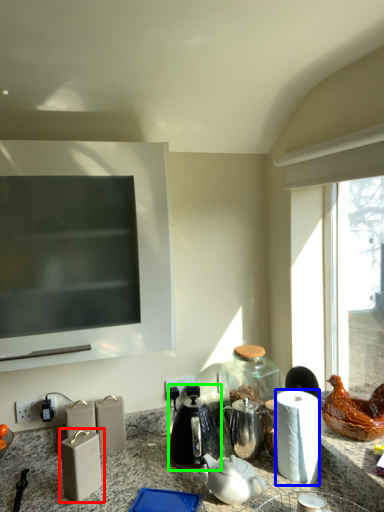
Question: Which object is the closest to the appliance (highlighted by a red box)? Choose among these: paper towel (highlighted by a blue box) or coffeepot (highlighted by a green box).

Choices:
 (A) paper towel
 (B) coffeepot

Answer: (B)